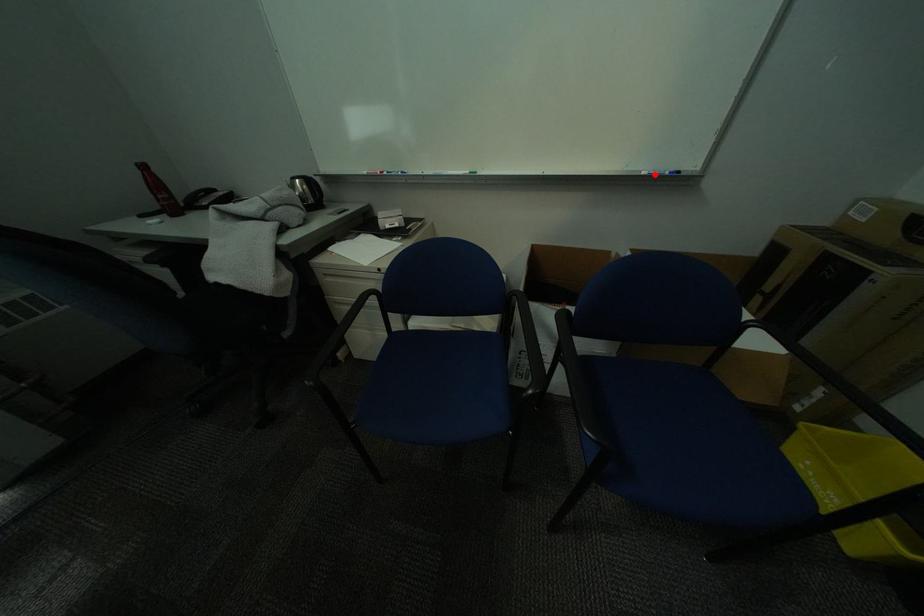
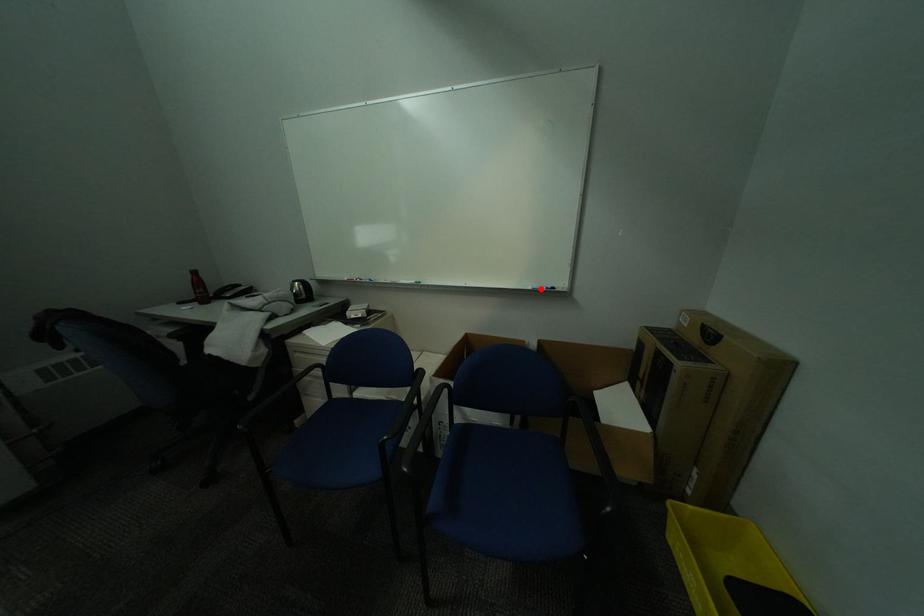
Based on the photo, I am providing you with two images of the same scene from different viewpoints. A red point is marked on the first image and another point is marked on the second image. Is the red point in image1 aligned with the point shown in image2?

Yes